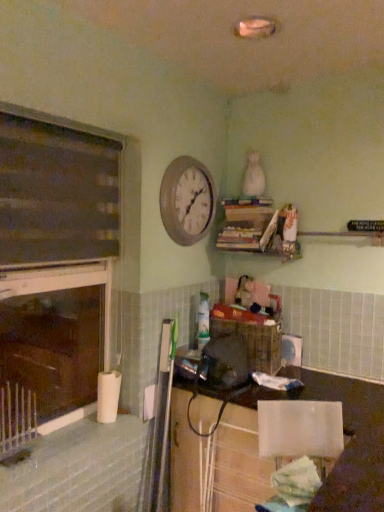
Question: From a real-world perspective, is wooden clock at upper center above or below silver metallic radiator at lower left?

Choices:
 (A) below
 (B) above

Answer: (B)

Question: Considering the positions of point (188, 231) and point (6, 396), is point (188, 231) closer or farther from the camera than point (6, 396)?

Choices:
 (A) farther
 (B) closer

Answer: (A)

Question: Based on their relative distances, which object is farther from the wooden clock at upper center?

Choices:
 (A) white fabric chair at lower right
 (B) silver metallic radiator at lower left
 (C) white glossy lampshade at lower right
 (D) dark wood window frame at left

Answer: (B)

Question: Which object is the farthest from the wooden clock at upper center?

Choices:
 (A) dark wood window frame at left
 (B) white fabric chair at lower right
 (C) white glossy lampshade at lower right
 (D) silver metallic radiator at lower left

Answer: (D)